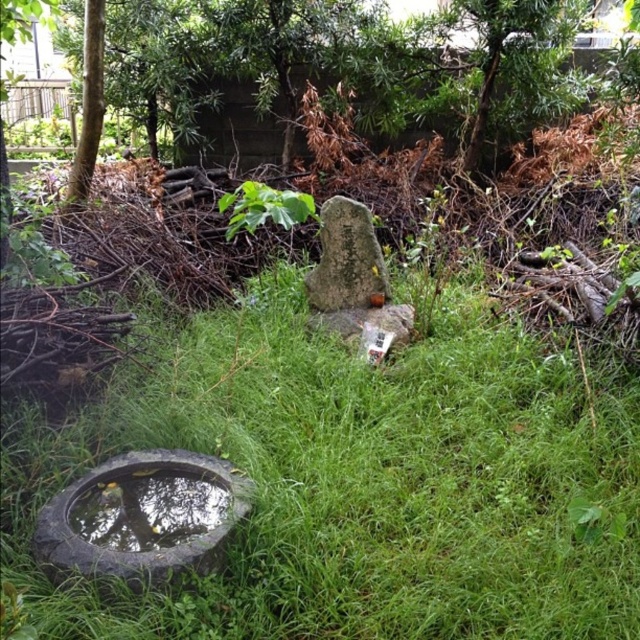
Can you confirm if dark gray rubber tire at lower left is smaller than green leafy plant at center?

Yes.

Can you confirm if dark gray rubber tire at lower left is wider than green leafy plant at center?

Yes, dark gray rubber tire at lower left is wider than green leafy plant at center.

The width and height of the screenshot is (640, 640). Describe the element at coordinates (141, 516) in the screenshot. I see `dark gray rubber tire at lower left` at that location.

Find the location of a particular element. dark gray rubber tire at lower left is located at coordinates (141, 516).

Does green grass at center come in front of green leafy plant at center?

Yes.

Can you confirm if green grass at center is shorter than green leafy plant at center?

No.

The height and width of the screenshot is (640, 640). I want to click on green grass at center, so click(364, 481).

This screenshot has height=640, width=640. Identify the location of green grass at center. (364, 481).

Between reflective stone basin at lower left and green leafy plant at center, which one has more height?

Standing taller between the two is green leafy plant at center.

Who is more distant from viewer, (x=125, y=472) or (x=284, y=202)?

Point (x=284, y=202)

At what (x,y) coordinates should I click in order to perform the action: click on reflective stone basin at lower left. Please return your answer as a coordinate pair (x, y). The height and width of the screenshot is (640, 640). Looking at the image, I should click on (148, 508).